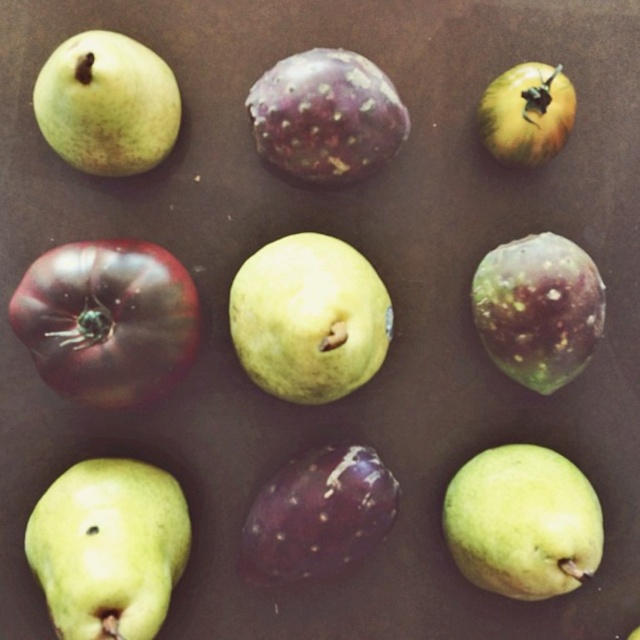
Question: Which object appears closest to the camera in this image?

Choices:
 (A) shiny dark red tomato at center left
 (B) green matte pear at center
 (C) purple matte fig at center-right
 (D) green matte pear at lower left

Answer: (D)

Question: Among these objects, which one is nearest to the camera?

Choices:
 (A) green matte pear at upper left
 (B) green matte pear at center
 (C) green matte pear at lower left

Answer: (A)

Question: Can you confirm if green matte pear at center is wider than green matte pear at upper left?

Choices:
 (A) yes
 (B) no

Answer: (A)

Question: Is green matte pear at lower left above green matte pear at lower right?

Choices:
 (A) yes
 (B) no

Answer: (B)

Question: Which point is farther to the camera?

Choices:
 (A) (582, 577)
 (B) (548, 109)
 (C) (509, 356)

Answer: (C)

Question: Is green matte pear at lower right thinner than green matte pear at upper left?

Choices:
 (A) yes
 (B) no

Answer: (B)